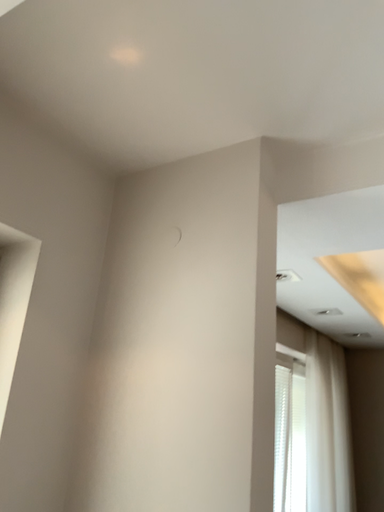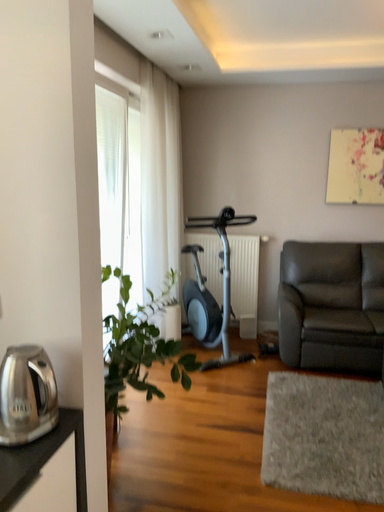
Question: Which way did the camera rotate in the video?

Choices:
 (A) rotated upward
 (B) rotated downward

Answer: (B)